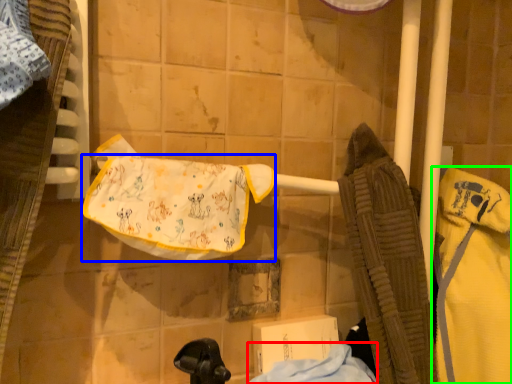
Question: Which is farther away from cloth (highlighted by a red box)? underclothes (highlighted by a blue box) or bathrobe (highlighted by a green box)?

Choices:
 (A) underclothes
 (B) bathrobe

Answer: (A)